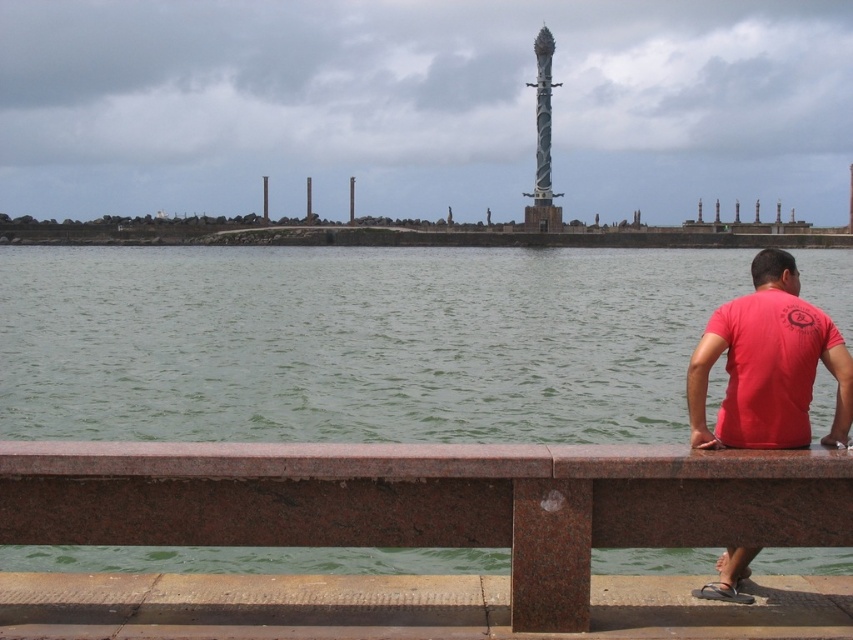
Looking at this image, you are standing at the point with coordinates point (398, 467) and want to walk to the point with coordinates point (483, 348). According to the scene description, will you have to walk towards the foreground or the background?

According to the scene description, point 0.545, 067 is behind point (398, 467). Therefore, you would need to walk towards the background to reach it.

You are standing at the waterfront scene and want to know which object is taller between the green water at lower center and the spiral metal pole at center. Based on the scene, can you determine which one is taller?

The spiral metal pole at center is taller than the green water at lower center.

You are a photographer trying to capture the entire brown granite rail at lower center and green water at lower center in one frame. Based on their sizes, which object will occupy more of the photo?

The green water at lower center will occupy more of the photo since it has a larger size compared to the brown granite rail at lower center.